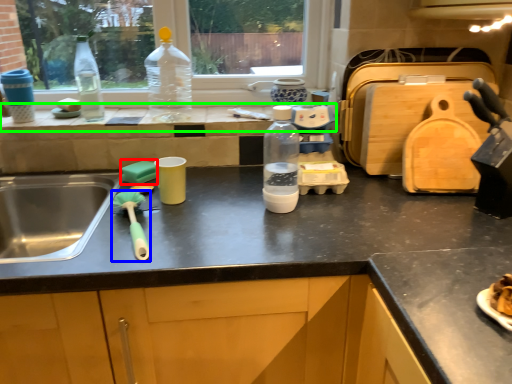
Question: Which is nearer to the food (highlighted by a red box)? brush (highlighted by a blue box) or window sill (highlighted by a green box).

Choices:
 (A) brush
 (B) window sill

Answer: (A)